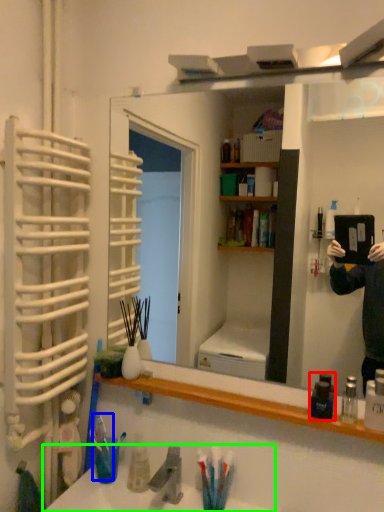
Question: Estimate the real-world distances between objects in this image. Which object is closer to mouthwash (highlighted by a red box), toothbrush (highlighted by a blue box) or sink (highlighted by a green box)?

Choices:
 (A) toothbrush
 (B) sink

Answer: (B)